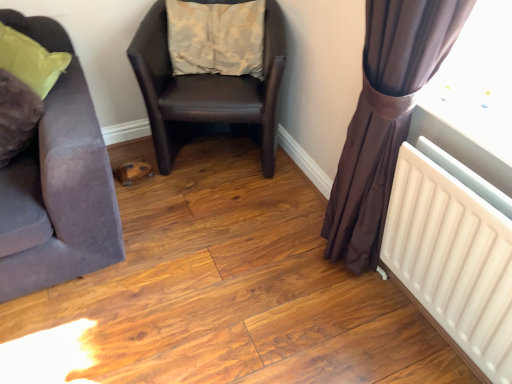
Question: In terms of height, does beige fabric pillow at center look taller or shorter compared to brown sheer curtain at right?

Choices:
 (A) tall
 (B) short

Answer: (B)

Question: Considering the positions of point (166, 3) and point (367, 89), is point (166, 3) closer or farther from the camera than point (367, 89)?

Choices:
 (A) farther
 (B) closer

Answer: (A)

Question: Which is farther from the brown leather chair at center, which ranks as the second chair in left-to-right order?

Choices:
 (A) beige fabric pillow at center
 (B) white plastic radiator at lower right
 (C) suede-like brown chair at left, which is the 2th chair from right to left
 (D) brown sheer curtain at right

Answer: (B)

Question: Based on their relative distances, which object is nearer to the brown sheer curtain at right?

Choices:
 (A) brown leather chair at center, which ranks as the second chair in left-to-right order
 (B) suede-like brown chair at left, which is the 2th chair from right to left
 (C) beige fabric pillow at center
 (D) white plastic radiator at lower right

Answer: (D)